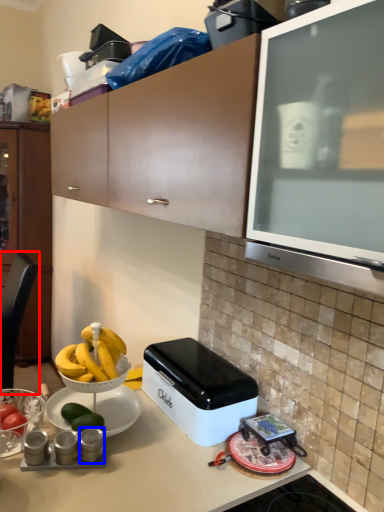
Question: Which object appears farthest to the camera in this image, chair (highlighted by a red box) or appliance (highlighted by a blue box)?

Choices:
 (A) chair
 (B) appliance

Answer: (A)